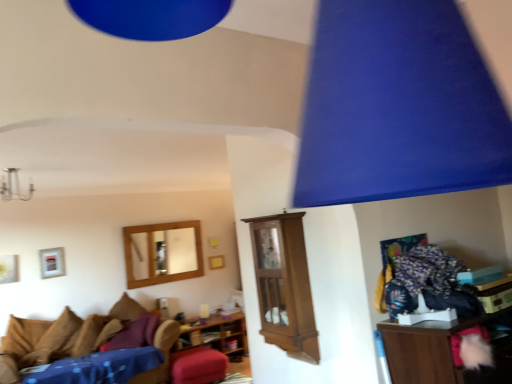
Question: Is silver metallic picture frame at upper left, which is counted as the 2th picture frame, starting from the back, aimed at brown suede pillow at lower left, which is the first pillow from front to back?

Choices:
 (A) yes
 (B) no

Answer: (B)

Question: From the image's perspective, would you say silver metallic picture frame at upper left, arranged as the 2th picture frame when viewed from the right, is shown under brown suede pillow at lower left, which is the first pillow from front to back?

Choices:
 (A) no
 (B) yes

Answer: (A)

Question: Is brown suede pillow at lower left, which is the 2th pillow in back-to-front order, located within silver metallic picture frame at upper left, which is counted as the 1th picture frame, starting from the left?

Choices:
 (A) yes
 (B) no

Answer: (B)

Question: Considering the relative sizes of silver metallic picture frame at upper left, arranged as the 2th picture frame when viewed from the right, and brown suede pillow at lower left, which is the 2th pillow in back-to-front order, in the image provided, is silver metallic picture frame at upper left, arranged as the 2th picture frame when viewed from the right, thinner than brown suede pillow at lower left, which is the 2th pillow in back-to-front order,?

Choices:
 (A) no
 (B) yes

Answer: (B)

Question: Considering the relative sizes of silver metallic picture frame at upper left, the 1th picture frame viewed from the front, and brown suede pillow at lower left, which is the 2th pillow in back-to-front order, in the image provided, is silver metallic picture frame at upper left, the 1th picture frame viewed from the front, bigger than brown suede pillow at lower left, which is the 2th pillow in back-to-front order,?

Choices:
 (A) no
 (B) yes

Answer: (A)

Question: Is velvet purple sofa at lower left inside or outside of wooden/matte picture frame at center, which is the first picture frame from right to left?

Choices:
 (A) outside
 (B) inside

Answer: (A)

Question: Visually, is velvet purple sofa at lower left positioned to the left or to the right of wooden/matte picture frame at center, which is the first picture frame from right to left?

Choices:
 (A) left
 (B) right

Answer: (A)

Question: Is velvet purple sofa at lower left taller or shorter than wooden/matte picture frame at center, which is the first picture frame from right to left?

Choices:
 (A) short
 (B) tall

Answer: (A)

Question: From the image's perspective, is velvet purple sofa at lower left positioned above or below wooden/matte picture frame at center, placed as the second picture frame when sorted from front to back?

Choices:
 (A) below
 (B) above

Answer: (A)

Question: Is metallic chandelier at upper left spatially inside brown fabric pillow at lower left, which is counted as the 2th pillow, starting from the front, or outside of it?

Choices:
 (A) outside
 (B) inside

Answer: (A)

Question: From the image's perspective, is metallic chandelier at upper left positioned above or below brown fabric pillow at lower left, the first pillow positioned from the back?

Choices:
 (A) above
 (B) below

Answer: (A)

Question: From a real-world perspective, is metallic chandelier at upper left positioned above or below brown fabric pillow at lower left, the first pillow positioned from the back?

Choices:
 (A) above
 (B) below

Answer: (A)

Question: Is metallic chandelier at upper left to the left or to the right of brown fabric pillow at lower left, which is counted as the 2th pillow, starting from the front, in the image?

Choices:
 (A) left
 (B) right

Answer: (A)

Question: Visually, is wooden cabinet at center, marked as the first shelf in a front-to-back arrangement, positioned to the left or to the right of brown suede pillow at lower left, which is the 2th pillow in back-to-front order?

Choices:
 (A) left
 (B) right

Answer: (B)

Question: Is wooden cabinet at center, marked as the first shelf in a top-to-bottom arrangement, wider or thinner than brown suede pillow at lower left, which is the 2th pillow in back-to-front order?

Choices:
 (A) wide
 (B) thin

Answer: (B)